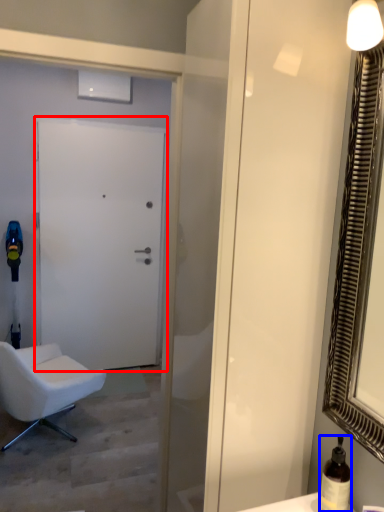
Question: Which of the following is the farthest to the observer, door (highlighted by a red box) or bottle (highlighted by a blue box)?

Choices:
 (A) door
 (B) bottle

Answer: (A)